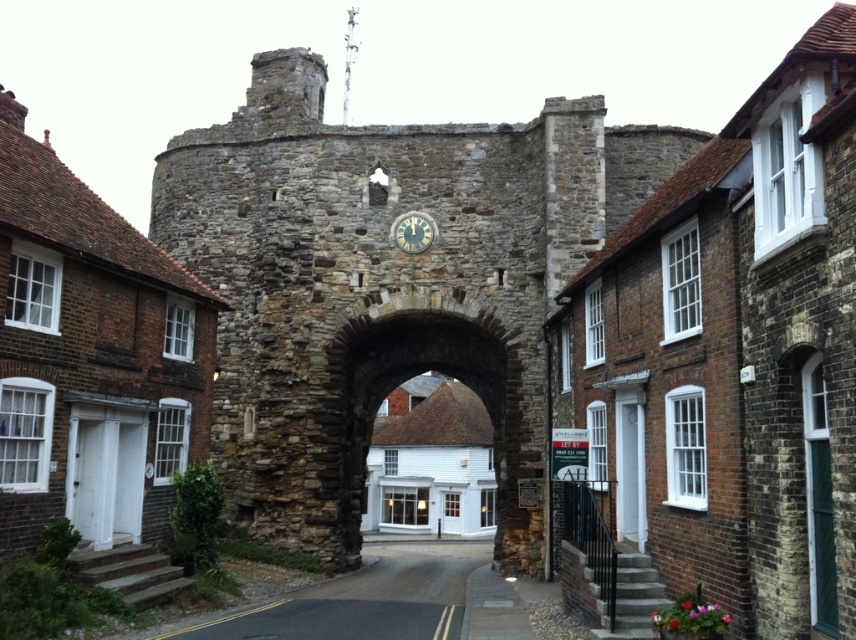
You are standing at the historic stone archway and want to take a photo of the point at coordinates (388, 307). If your camera has a maximum zoom range of 60 meters, will you be able to capture the point clearly in your photo?

The point at coordinates (388, 307) is 70.00 meters away from the camera, which exceeds the maximum zoom range of 60 meters. Therefore, you won the be able to capture the point clearly in your photo.